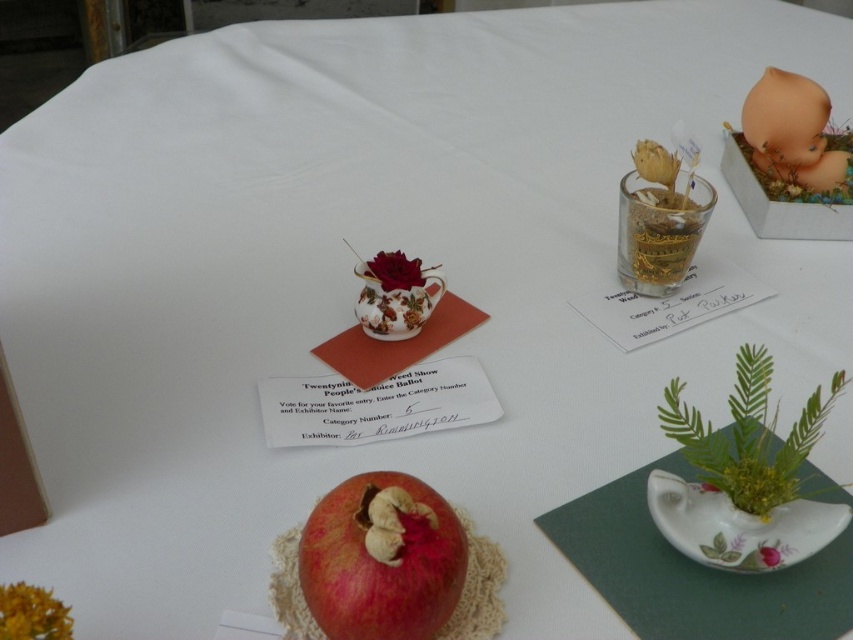
You are a judge at a gardening competition and need to determine which object is bigger between the matte peach baby doll at upper right and the yellow textured flower at lower left. Based on the display, which one is larger?

The matte peach baby doll at upper right is larger in size compared to the yellow textured flower at lower left.

You are a judge at a gardening competition and need to determine the spatial arrangement of the displayed items. Which object is located to the right of the other between the matte peach baby doll at upper right and the yellow textured flower at lower left?

The matte peach baby doll at upper right is positioned on the right side of the yellow textured flower at lower left.